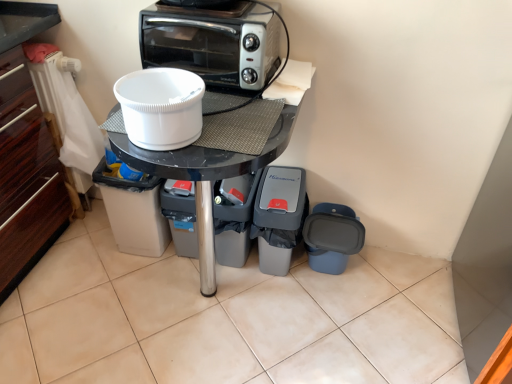
At what (x,y) coordinates should I click in order to perform the action: click on free space between black glossy table at center and gray plastic trash can at lower center, arranged as the second appliance when viewed from the right. Please return your answer as a coordinate pair (x, y). Looking at the image, I should click on (276, 309).